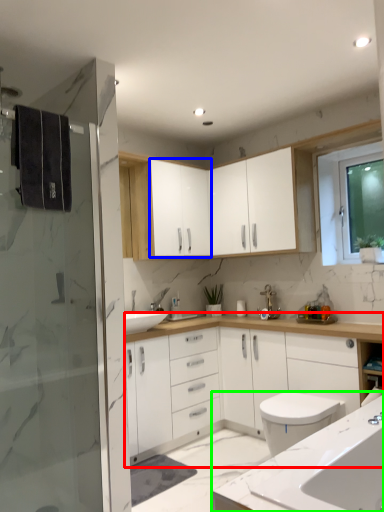
Question: Estimate the real-world distances between objects in this image. Which object is farther from bathroom cabinet (highlighted by a red box), cabinetry (highlighted by a blue box) or countertop (highlighted by a green box)?

Choices:
 (A) cabinetry
 (B) countertop

Answer: (B)